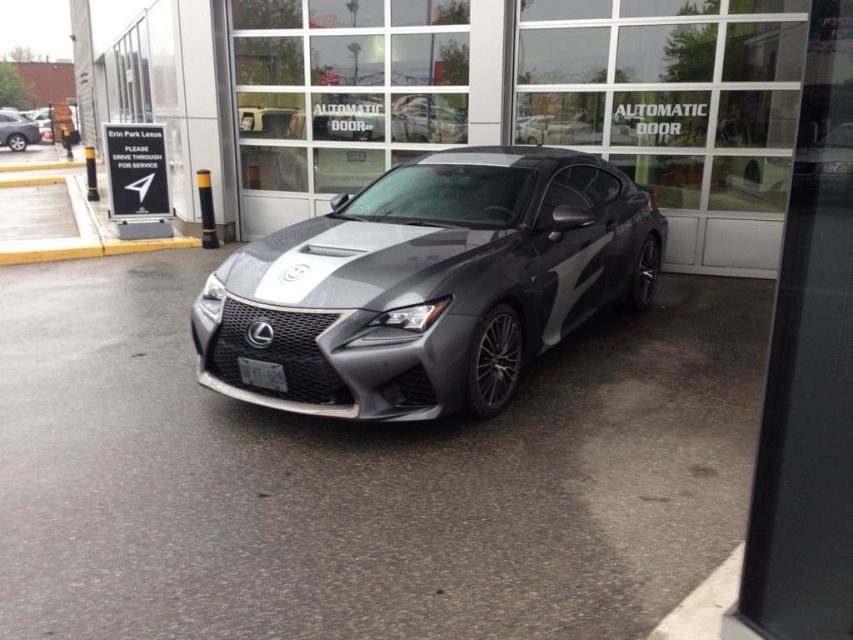
Which is below, glossy metallic car at center or satin metallic sedan at center?

Positioned lower is satin metallic sedan at center.

Is glossy metallic car at center shorter than satin metallic sedan at center?

Result: No.

Who is more forward, (328, 99) or (561, 195)?

Point (561, 195)

This screenshot has width=853, height=640. I want to click on glossy metallic car at center, so click(x=461, y=97).

Does satin metallic sedan at center have a larger size compared to matte black car at left?

Correct, satin metallic sedan at center is larger in size than matte black car at left.

In order to click on satin metallic sedan at center in this screenshot , I will do `click(427, 284)`.

Does point (323, 74) come in front of point (16, 136)?

Yes, point (323, 74) is in front of point (16, 136).

Image resolution: width=853 pixels, height=640 pixels. What do you see at coordinates (461, 97) in the screenshot? I see `glossy metallic car at center` at bounding box center [461, 97].

Who is more distant from viewer, (427, 80) or (0, 140)?

The point (0, 140) is behind.

Identify the location of glossy metallic car at center. This screenshot has width=853, height=640. (461, 97).